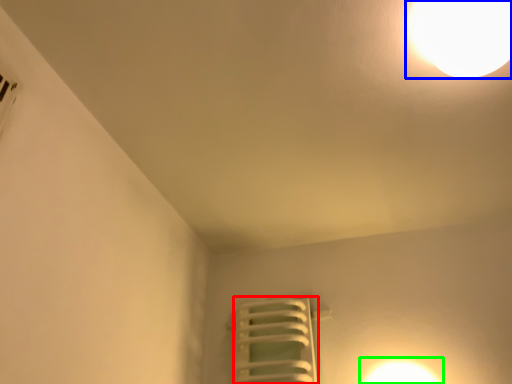
Question: Based on their relative distances, which object is farther from radiator (highlighted by a red box)? Choose from lamp (highlighted by a blue box) and light (highlighted by a green box).

Choices:
 (A) lamp
 (B) light

Answer: (A)